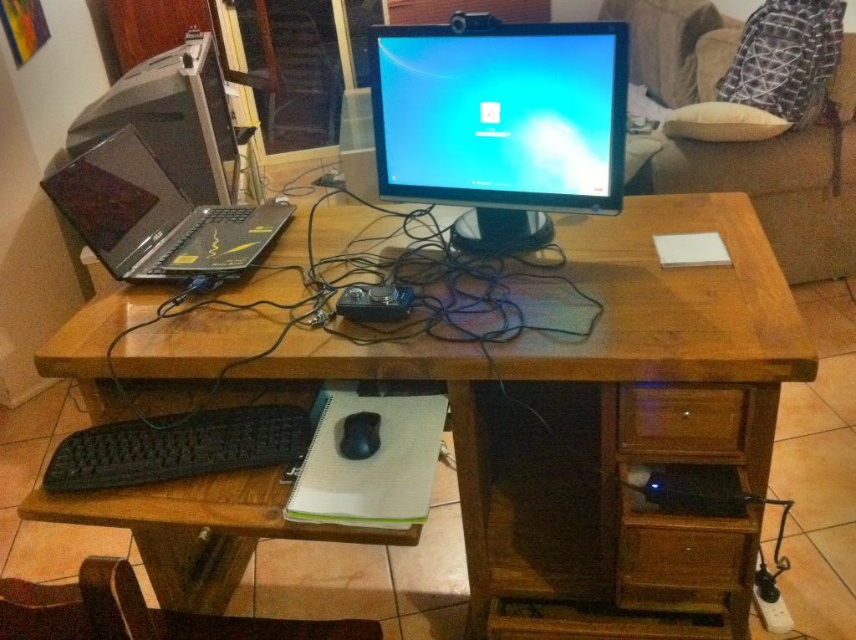
You are setting up a new computer setup on the wooden desk. You have a satin black monitor at center and a black matte mouse at lower center. Which object should you place first if you want to ensure there is enough space for both items?

You should place the satin black monitor at center first since it has a larger size compared to the black matte mouse at lower center, ensuring there is enough space for both items.

From the picture: You are organizing a small event and need to place a 1.2 meter long banner on the desk. Given the wooden computer desk at center and the wooden drawer at lower right, which surface can accommodate the banner without overlapping any objects?

The wooden computer desk at center can accommodate the banner since its width is greater than the wooden drawer at lower right, making it suitable for the 1.2 meter banner.